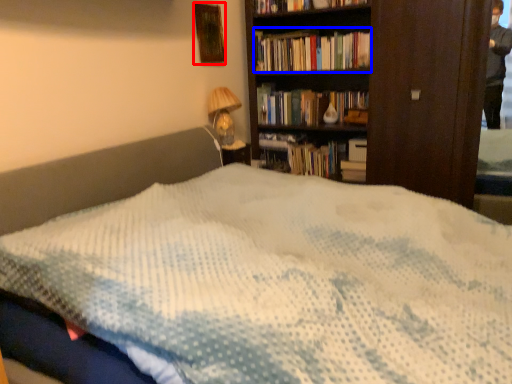
Question: Which object appears farthest to the camera in this image, picture frame (highlighted by a red box) or book (highlighted by a blue box)?

Choices:
 (A) picture frame
 (B) book

Answer: (B)